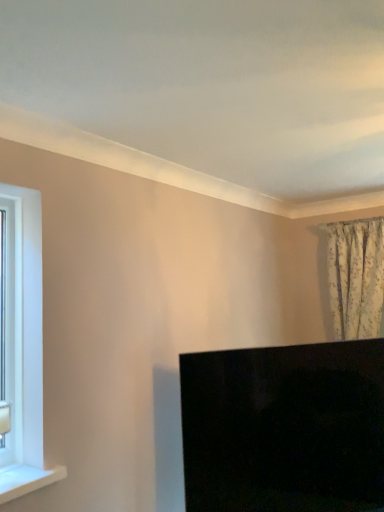
Question: Is white plastic window frame at left inside white glossy window sill at lower left?

Choices:
 (A) yes
 (B) no

Answer: (B)

Question: Is white glossy window sill at lower left at the left side of white plastic window frame at left?

Choices:
 (A) no
 (B) yes

Answer: (A)

Question: Does white glossy window sill at lower left have a greater height compared to white plastic window frame at left?

Choices:
 (A) yes
 (B) no

Answer: (B)

Question: Is white glossy window sill at lower left closer to the viewer compared to white plastic window frame at left?

Choices:
 (A) no
 (B) yes

Answer: (B)

Question: Considering the relative sizes of white glossy window sill at lower left and white plastic window frame at left in the image provided, is white glossy window sill at lower left bigger than white plastic window frame at left?

Choices:
 (A) yes
 (B) no

Answer: (B)

Question: In the image, is black glossy monitor at lower right positioned in front of or behind white plastic window frame at left?

Choices:
 (A) front
 (B) behind

Answer: (B)

Question: From a real-world perspective, is black glossy monitor at lower right above or below white plastic window frame at left?

Choices:
 (A) below
 (B) above

Answer: (A)

Question: From the image's perspective, relative to white plastic window frame at left, is black glossy monitor at lower right above or below?

Choices:
 (A) below
 (B) above

Answer: (A)

Question: In terms of width, does black glossy monitor at lower right look wider or thinner when compared to white plastic window frame at left?

Choices:
 (A) wide
 (B) thin

Answer: (A)

Question: Is white plastic window frame at left situated inside white glossy window sill at lower left or outside?

Choices:
 (A) inside
 (B) outside

Answer: (B)

Question: Relative to white glossy window sill at lower left, is white plastic window frame at left in front or behind?

Choices:
 (A) behind
 (B) front

Answer: (A)

Question: In the image, is white plastic window frame at left on the left side or the right side of white glossy window sill at lower left?

Choices:
 (A) right
 (B) left

Answer: (B)

Question: Is point (9, 448) closer or farther from the camera than point (33, 479)?

Choices:
 (A) closer
 (B) farther

Answer: (B)

Question: Considering the positions of white glossy window sill at lower left and black glossy monitor at lower right in the image, is white glossy window sill at lower left wider or thinner than black glossy monitor at lower right?

Choices:
 (A) thin
 (B) wide

Answer: (A)

Question: Considering the positions of point pos(11,483) and point pos(347,382), is point pos(11,483) closer or farther from the camera than point pos(347,382)?

Choices:
 (A) closer
 (B) farther

Answer: (A)